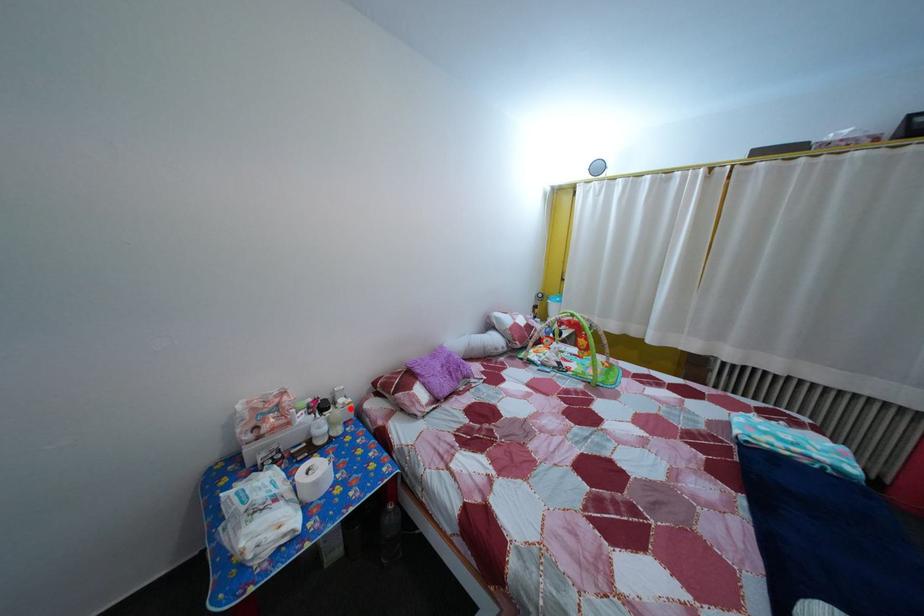
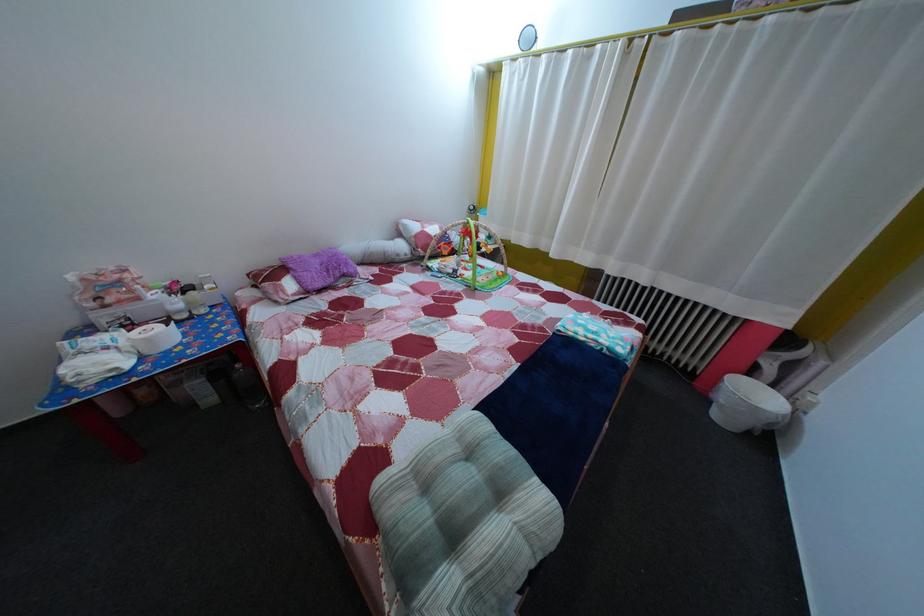
Question: I am providing you with two images of the same scene from different viewpoints. Given a red point in image1, look at the same physical point in image2. Is it:

Choices:
 (A) Closer to the viewpoint
 (B) Farther from the viewpoint

Answer: (A)